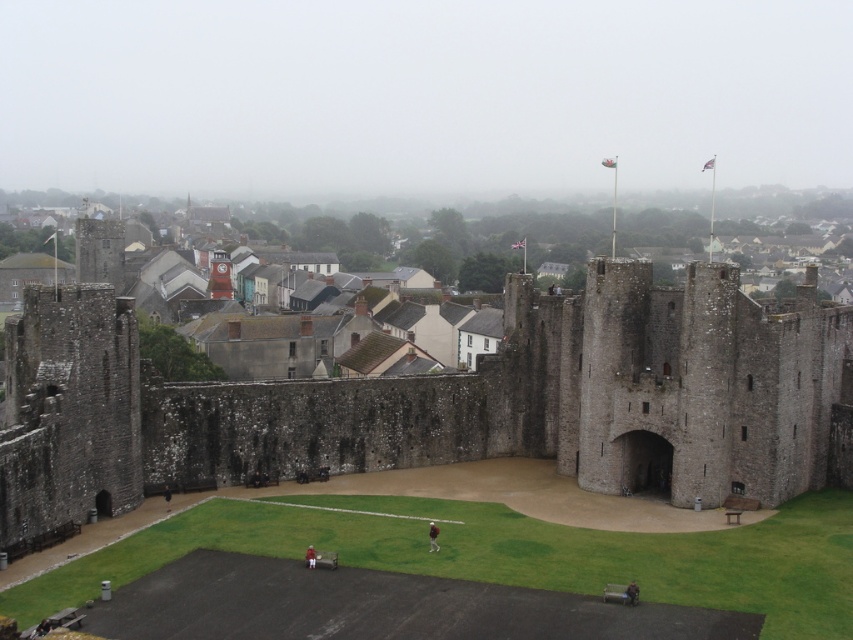
Can you confirm if red brick clock tower at center is positioned above light brown fabric jacket at center?

Yes.

Which of these two, red brick clock tower at center or light brown fabric jacket at center, stands shorter?

light brown fabric jacket at center is shorter.

What do you see at coordinates (219, 276) in the screenshot? The image size is (853, 640). I see `red brick clock tower at center` at bounding box center [219, 276].

Locate an element on the screen. The height and width of the screenshot is (640, 853). red brick clock tower at center is located at coordinates (219, 276).

Is the position of red brick clock tower at center less distant than that of red shirt at center?

No.

Which of these two, red brick clock tower at center or red shirt at center, stands shorter?

Standing shorter between the two is red shirt at center.

Between point (228, 289) and point (314, 561), which one is positioned behind?

Positioned behind is point (228, 289).

This screenshot has width=853, height=640. In order to click on red brick clock tower at center in this screenshot , I will do `click(219, 276)`.

What do you see at coordinates (432, 536) in the screenshot? Image resolution: width=853 pixels, height=640 pixels. I see `light brown fabric jacket at center` at bounding box center [432, 536].

Does light brown fabric jacket at center have a greater height compared to red shirt at center?

Yes, light brown fabric jacket at center is taller than red shirt at center.

Is point (436, 547) farther from camera compared to point (312, 563)?

Yes, it is behind point (312, 563).

At what (x,y) coordinates should I click in order to perform the action: click on light brown fabric jacket at center. Please return your answer as a coordinate pair (x, y). Image resolution: width=853 pixels, height=640 pixels. Looking at the image, I should click on (432, 536).